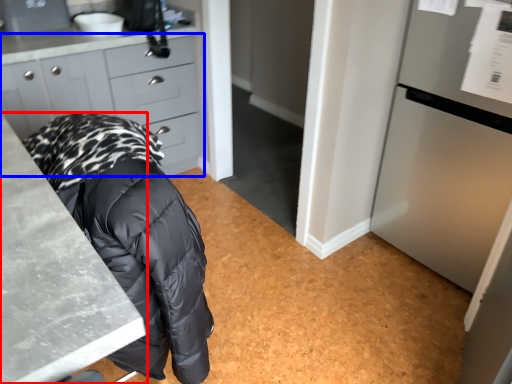
Question: Among these objects, which one is nearest to the camera, countertop (highlighted by a red box) or cabinetry (highlighted by a blue box)?

Choices:
 (A) countertop
 (B) cabinetry

Answer: (A)